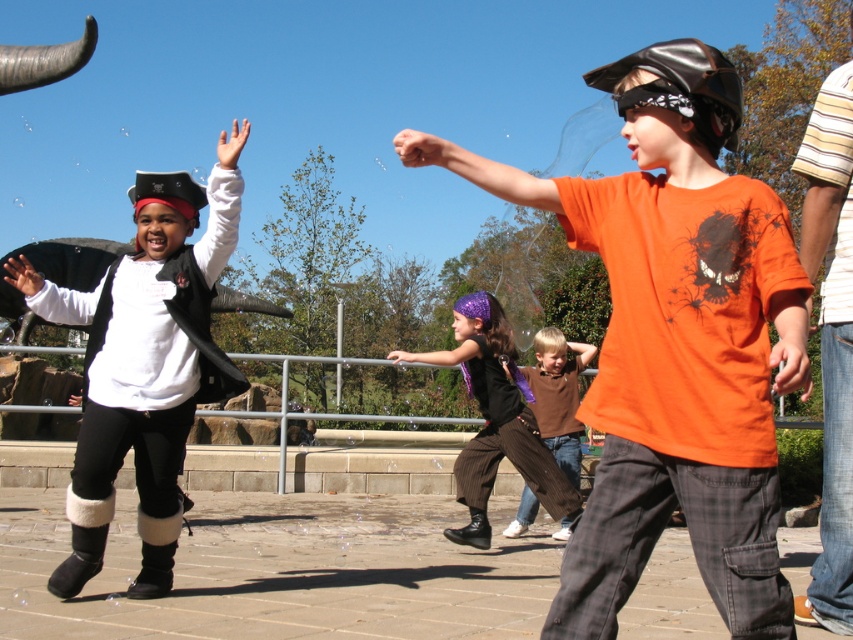
In the scene shown: You are standing in the park and see two points in the image. Which point, point (480, 385) or point (526, 506), is closer to you?

Point (480, 385) is closer to the viewer than point (526, 506).